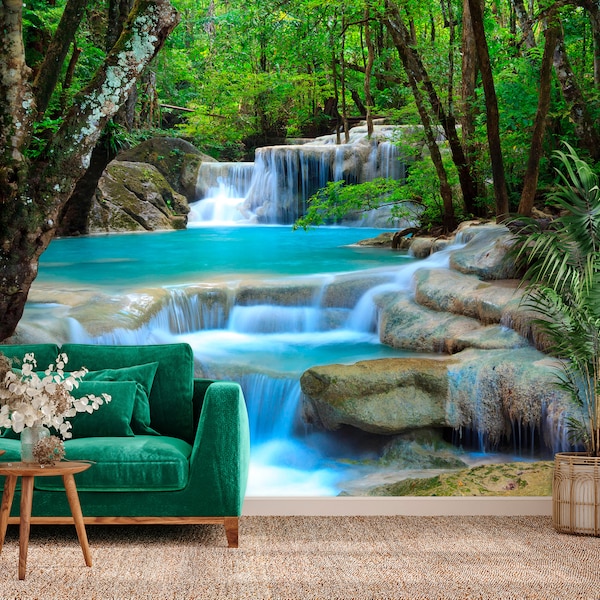
Find the location of `carpet`. carpet is located at coordinates (465, 541).